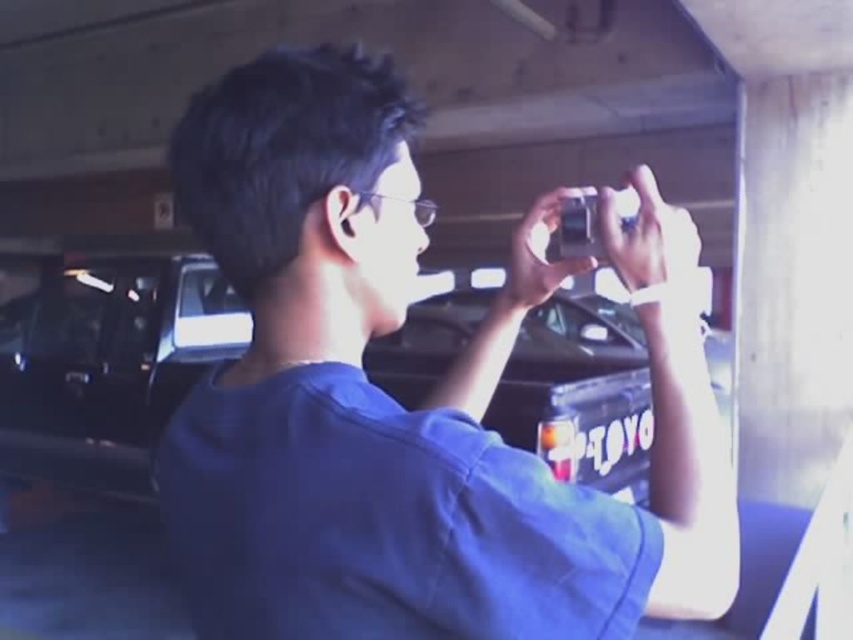
Question: Can you confirm if blue fabric shirt at center is positioned to the right of glossy black truck at center?

Choices:
 (A) yes
 (B) no

Answer: (A)

Question: Is blue fabric shirt at center closer to camera compared to glossy black truck at center?

Choices:
 (A) no
 (B) yes

Answer: (B)

Question: Can you confirm if blue fabric shirt at center is bigger than glossy black truck at center?

Choices:
 (A) no
 (B) yes

Answer: (A)

Question: Which point is closer to the camera?

Choices:
 (A) glossy black truck at center
 (B) blue fabric shirt at center

Answer: (B)